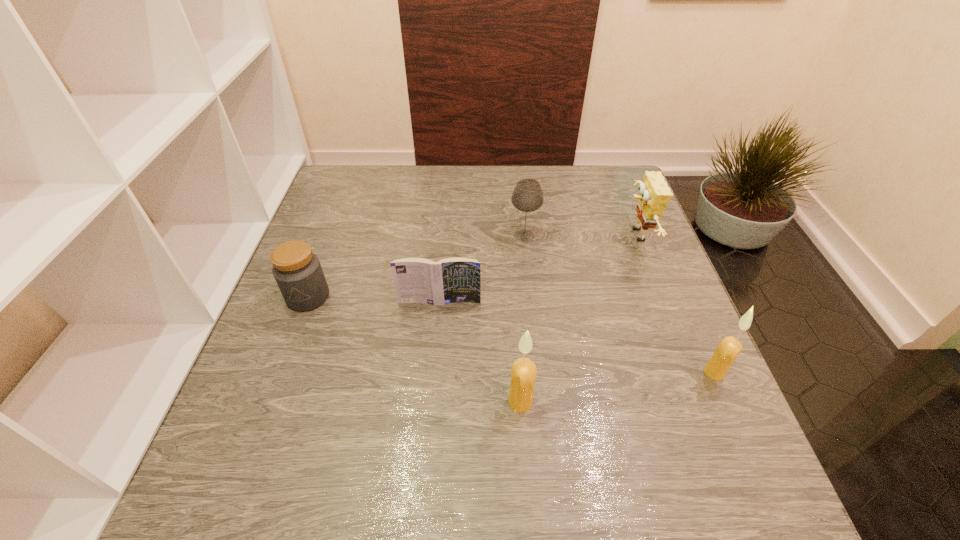
Where is `free region located on the face of the sponge`? This screenshot has width=960, height=540. free region located on the face of the sponge is located at coordinates (554, 235).

You are a GUI agent. You are given a task and a screenshot of the screen. Output one action in this format:
    pyautogui.click(x=<x>, y=<y>)
    Task: Click on the free location located on the face of the sponge
    
    Given the screenshot: What is the action you would take?
    pyautogui.click(x=581, y=235)

Identify the location of free space located on the face of the sponge. The width and height of the screenshot is (960, 540). (470, 235).

The width and height of the screenshot is (960, 540). I want to click on vacant space located 0.260m on the front cover of the book, so click(430, 413).

Where is `vacant space situated 0.240m on the surface of the jar near the warning symbol`? Image resolution: width=960 pixels, height=540 pixels. vacant space situated 0.240m on the surface of the jar near the warning symbol is located at coordinates (264, 414).

Image resolution: width=960 pixels, height=540 pixels. Identify the location of free space located on the back of the wineglass. (520, 202).

Identify the location of object located in the far edge section of the desktop. Image resolution: width=960 pixels, height=540 pixels. pos(654,195).

What are the coordinates of `object at the near edge` in the screenshot? It's located at (523, 374).

Where is `object located at the left edge`? The width and height of the screenshot is (960, 540). object located at the left edge is located at coordinates (297, 270).

The width and height of the screenshot is (960, 540). I want to click on candle positioned at the right edge, so click(728, 349).